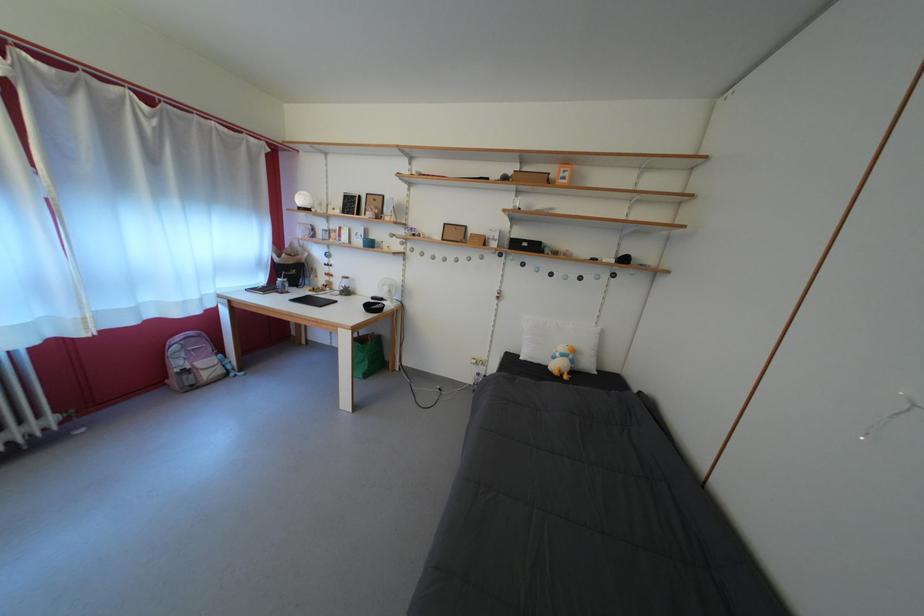
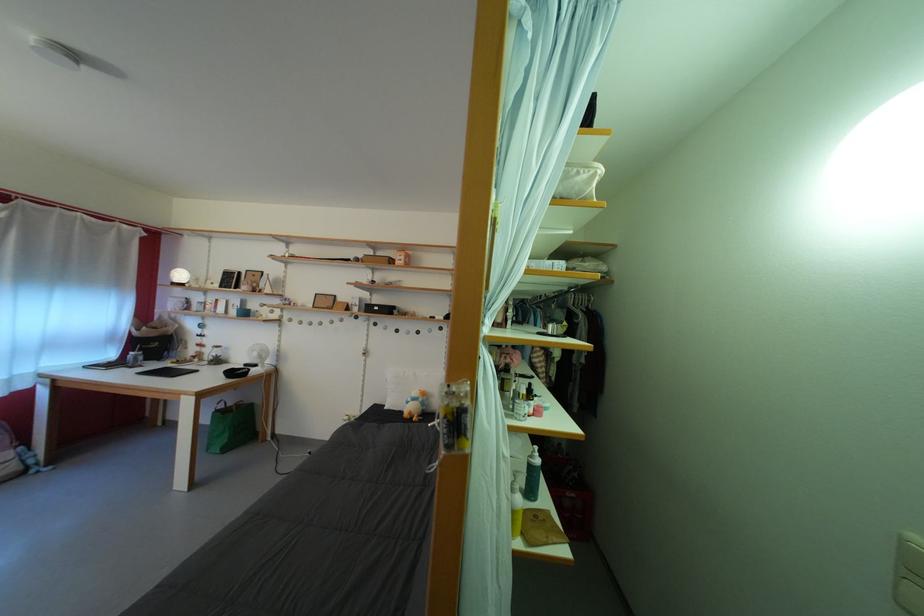
Where in the second image is the point corresponding to point (395, 294) from the first image?

(263, 360)